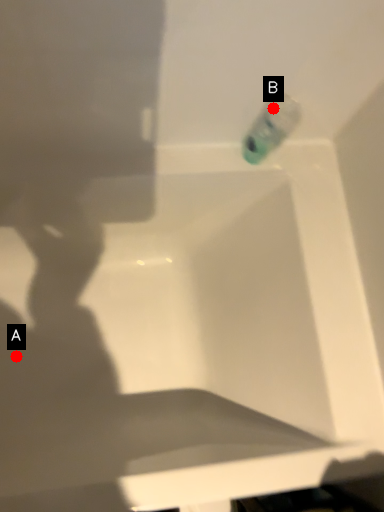
Question: Two points are circled on the image, labeled by A and B beside each circle. Which point is closer to the camera?

Choices:
 (A) A is closer
 (B) B is closer

Answer: (B)